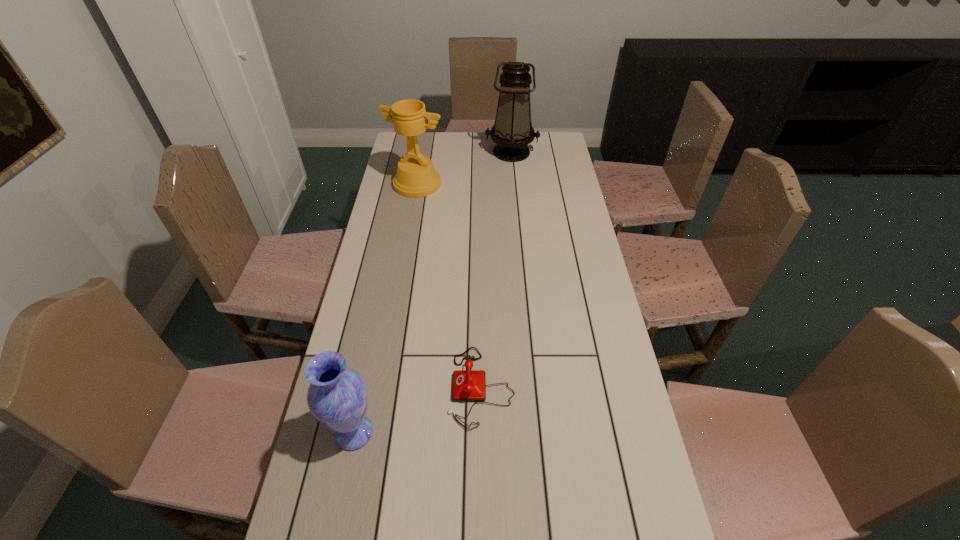
You are a GUI agent. You are given a task and a screenshot of the screen. Output one action in this format:
    pyautogui.click(x=<x>, y=<y>)
    Task: Click on the free space between the award and the shortest object
    The height and width of the screenshot is (540, 960).
    Given the screenshot: What is the action you would take?
    pyautogui.click(x=449, y=285)

Where is `free space between the shortest object and the vase`? free space between the shortest object and the vase is located at coordinates (418, 410).

Where is `free spot between the telephone and the vase`? Image resolution: width=960 pixels, height=540 pixels. free spot between the telephone and the vase is located at coordinates click(x=418, y=410).

The height and width of the screenshot is (540, 960). Find the location of `vacant area between the shortest object and the tallest object`. vacant area between the shortest object and the tallest object is located at coordinates (496, 269).

Find the location of a particular element. free spot between the award and the farthest object is located at coordinates (465, 168).

Where is `vacant space that's between the oil lamp and the award`? vacant space that's between the oil lamp and the award is located at coordinates (465, 168).

You are a GUI agent. You are given a task and a screenshot of the screen. Output one action in this format:
    pyautogui.click(x=<x>, y=<y>)
    Task: Click on the blank region between the shortest object and the award
    The image size is (960, 540).
    Given the screenshot: What is the action you would take?
    pyautogui.click(x=449, y=285)

The image size is (960, 540). What are the coordinates of `vacant region between the farthest object and the shortest object` in the screenshot? It's located at [496, 269].

Locate an element on the screen. Image resolution: width=960 pixels, height=540 pixels. free space between the telephone and the second shortest object is located at coordinates (418, 410).

In order to click on free space between the tallest object and the shortest object in this screenshot , I will do `click(496, 269)`.